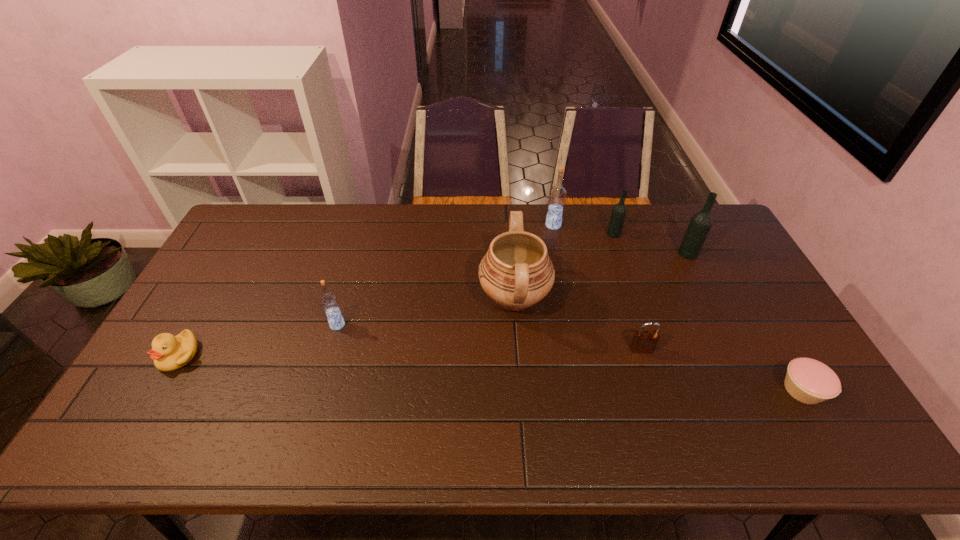
At what (x,y) coordinates should I click in order to perform the action: click on free region located on the right of the farther black vodka. Please return your answer as a coordinate pair (x, y). This screenshot has height=540, width=960. Looking at the image, I should click on (640, 234).

This screenshot has height=540, width=960. I want to click on vacant space located 0.130m on the right of the nearest vodka, so (x=390, y=325).

Locate an element on the screen. The image size is (960, 540). free space located 0.170m on the front-facing side of the brown padlock is located at coordinates point(660,410).

This screenshot has height=540, width=960. Find the location of `free location located 0.190m on the front-facing side of the duckling`. free location located 0.190m on the front-facing side of the duckling is located at coordinates pos(128,443).

Where is `vacant space located 0.150m on the back of the shortest object`? The height and width of the screenshot is (540, 960). vacant space located 0.150m on the back of the shortest object is located at coordinates (765, 326).

Locate an element on the screen. object at the left edge is located at coordinates (169, 352).

You are a GUI agent. You are given a task and a screenshot of the screen. Output one action in this format:
    pyautogui.click(x=<x>, y=<y>)
    Task: Click on the vodka present at the right edge
    This screenshot has height=540, width=960.
    Given the screenshot: What is the action you would take?
    pyautogui.click(x=700, y=224)

The width and height of the screenshot is (960, 540). Identify the location of cupcake present at the right edge. (807, 380).

Find the location of a particular element. free space at the far edge is located at coordinates (461, 215).

Find the location of a particular element. blank space at the near edge of the desktop is located at coordinates (692, 423).